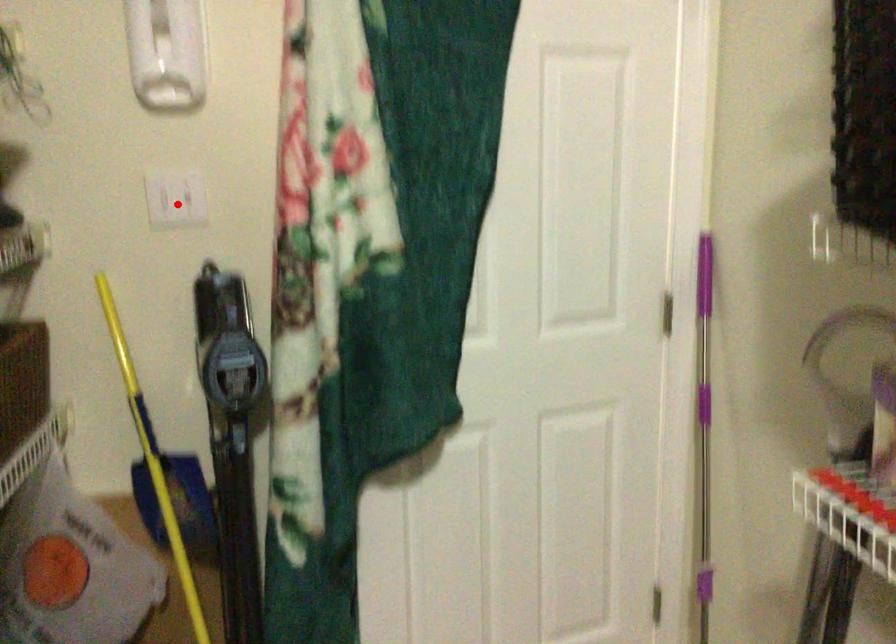
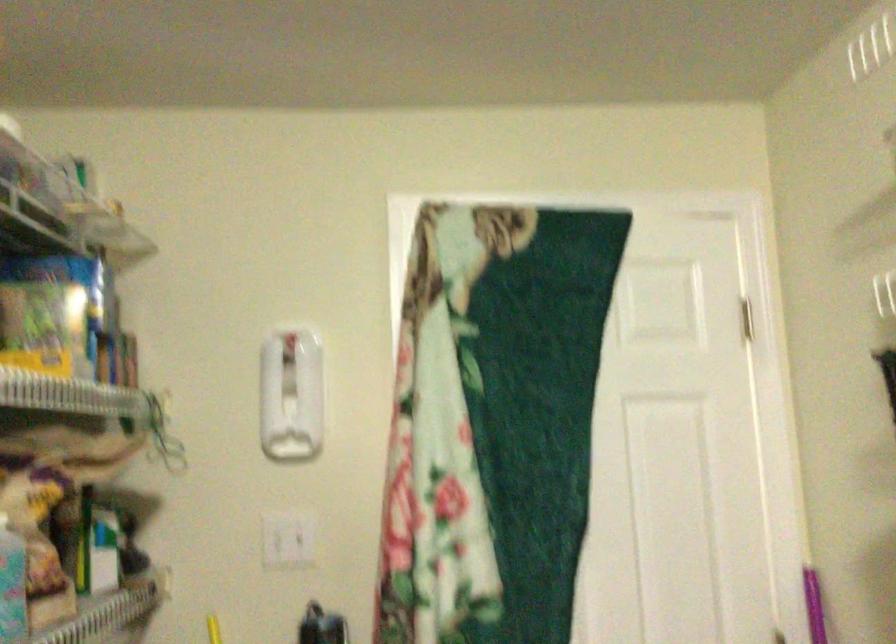
The point at the highlighted location is marked in the first image. Where is the corresponding point in the second image?

(288, 538)